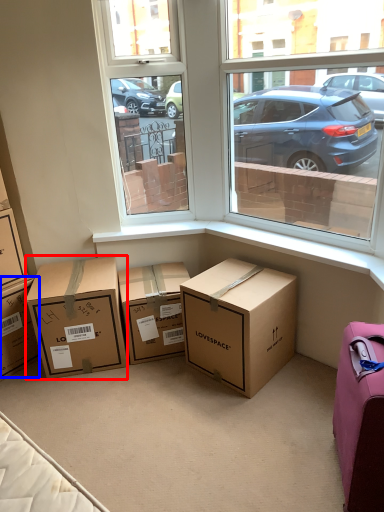
Question: Which object is closer to the camera taking this photo, box (highlighted by a red box) or box (highlighted by a blue box)?

Choices:
 (A) box
 (B) box

Answer: (A)